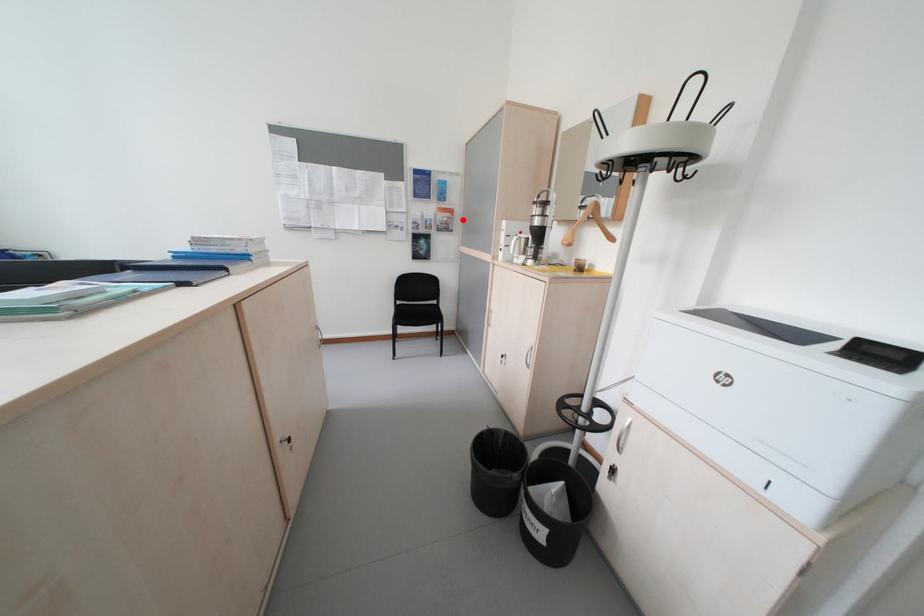
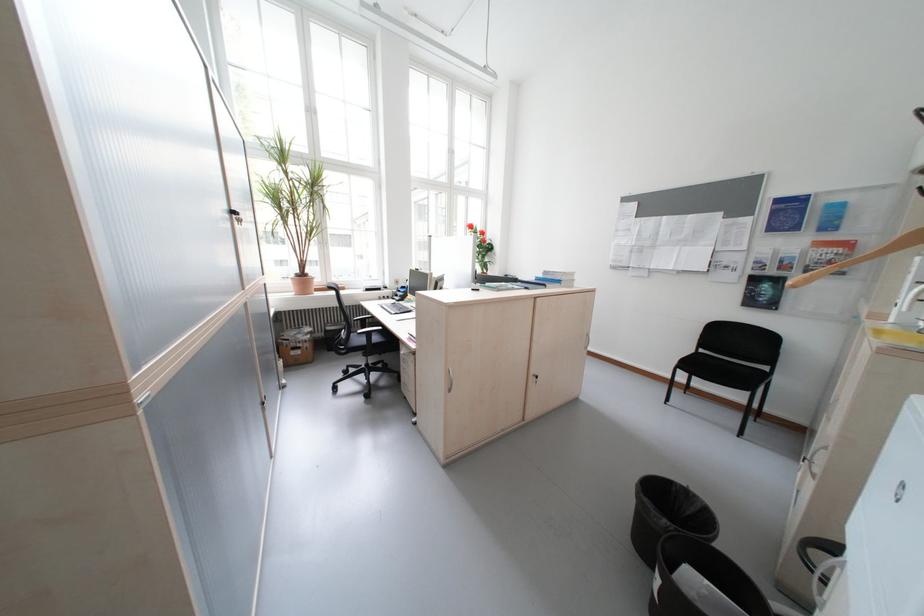
Question: I am providing you with two images of the same scene from different viewpoints. In image1, a red point is highlighted. Considering the same 3D point in image2, which of the following is correct?

Choices:
 (A) It is closer
 (B) It is farther

Answer: (B)